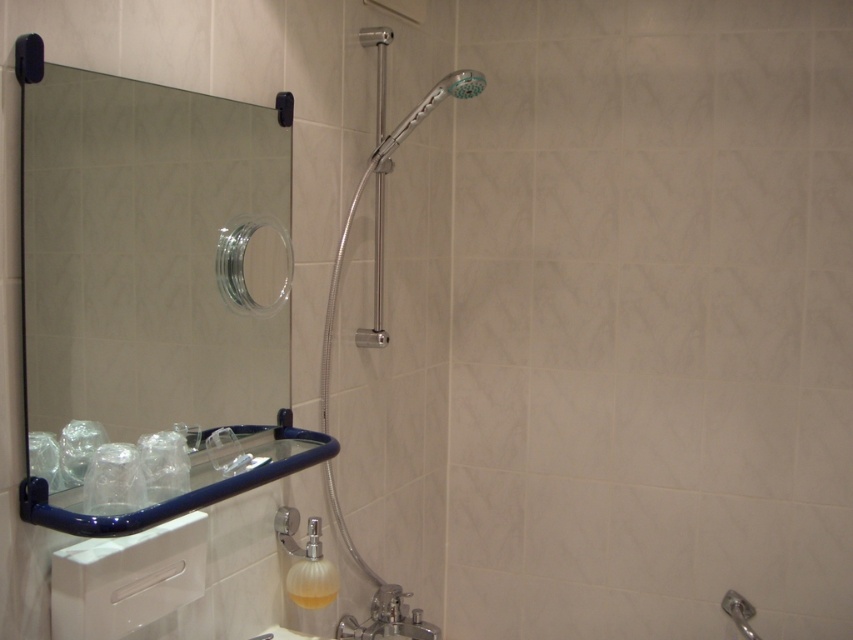
You are designing a bathroom layout and need to ensure that the polished chrome shower head at upper center and the translucent plastic soap dispenser at lower center are spaced appropriately. According to the image, which object is taller and should be placed higher to maintain visual balance?

The polished chrome shower head at upper center is taller than the translucent plastic soap dispenser at lower center, so it should be placed higher to maintain visual balance.

You are designing a bathroom layout and need to place both the transparent glass mirror at left and the translucent plastic soap dispenser at lower center. Based on their sizes, which object should be placed higher up to ensure proper visibility and accessibility?

The transparent glass mirror at left should be placed higher up since it is larger in size compared to the translucent plastic soap dispenser at lower center, allowing for better visibility and accessibility.

You are installing a new shower curtain rod and need to ensure it doesn not interfere with the polished chrome shower head at upper center. Based on the bathroom layout, where should you position the rod to avoid blocking the shower head?

The polished chrome shower head at upper center is located at point (381, 196). To avoid blocking it, position the shower curtain rod below this coordinate, ensuring it does not extend into the area occupied by the shower head.